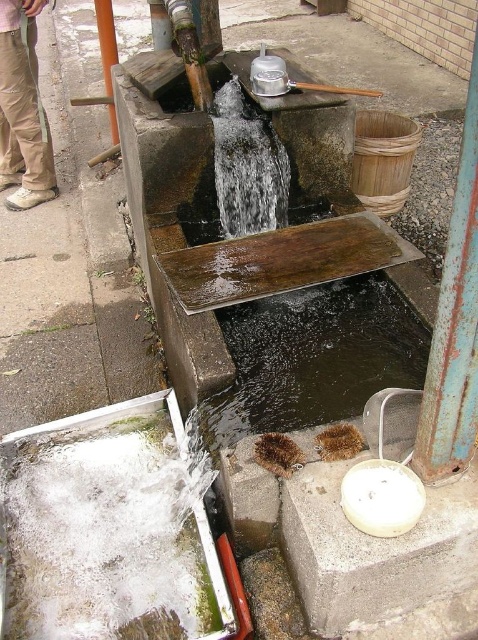
You are a visitor at this water feature and want to fill a small cup with water. Which part of the water would you choose between the brown textured water at center and the clear water at center, and why?

You should choose the clear water at center because it is smaller and likely calmer, making it easier to fill the cup without splashing. The brown textured water at center is bigger and might have stronger currents.

From the picture: You are standing at the base of the water feature and want to touch both the rusty metal pole at right and the smooth orange pole at upper left. Which pole will require you to look upward more to reach it?

The smooth orange pole at upper left requires looking upward more because it is taller than the rusty metal pole at right.